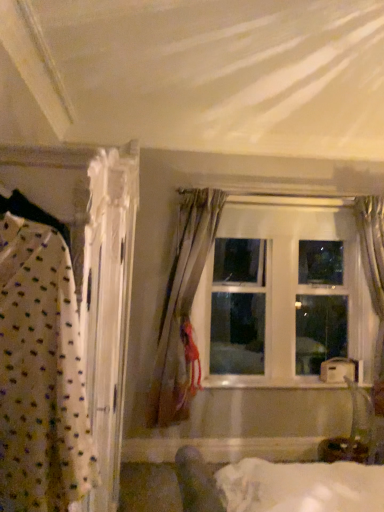
Question: Is point (205, 366) closer or farther from the camera than point (155, 396)?

Choices:
 (A) closer
 (B) farther

Answer: (B)

Question: From a real-world perspective, is clear glass window at center above or below silky beige curtain at center, the second curtain in the right-to-left sequence?

Choices:
 (A) above
 (B) below

Answer: (A)

Question: Which of these objects is positioned farthest from the silky beige curtain at center, which is the 1th curtain in left-to-right order?

Choices:
 (A) satin gray curtain at right, which ranks as the second curtain in left-to-right order
 (B) clear glass window at center
 (C) white glossy wood at center

Answer: (A)

Question: Which object is the farthest from the white glossy wood at center?

Choices:
 (A) clear glass window at center
 (B) silky beige curtain at center, the second curtain in the right-to-left sequence
 (C) satin gray curtain at right, which ranks as the second curtain in left-to-right order

Answer: (C)